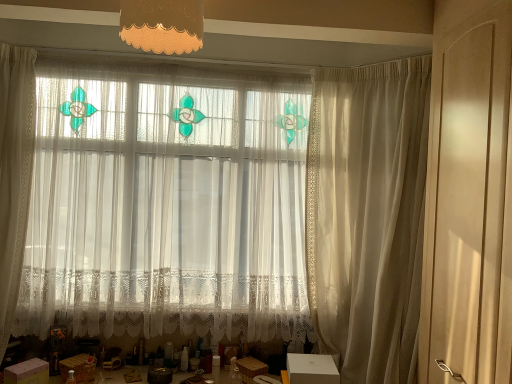
Locate an element on the screen. The image size is (512, 384). free space above white cardboard box at lower center, which is the first cardboard box from right to left (from a real-world perspective) is located at coordinates (307, 359).